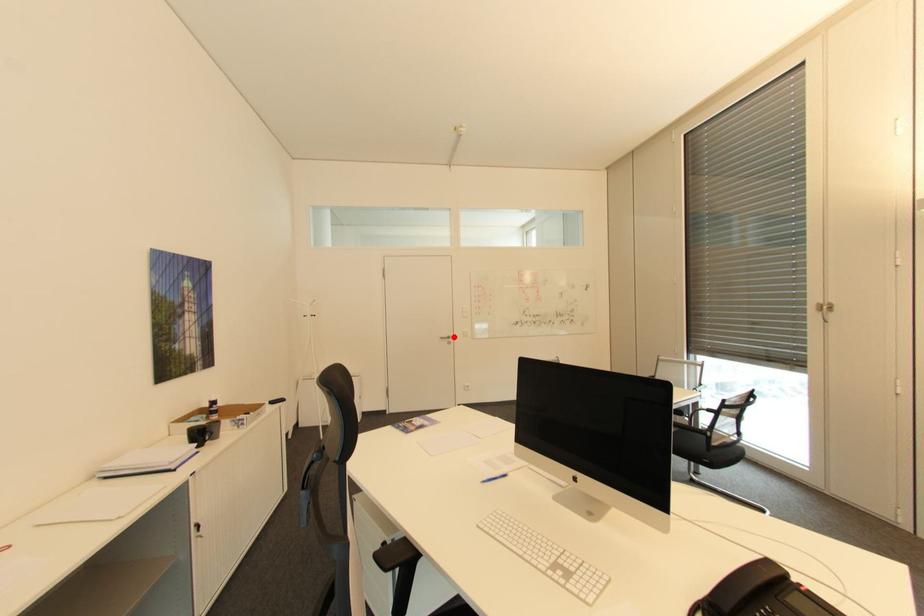
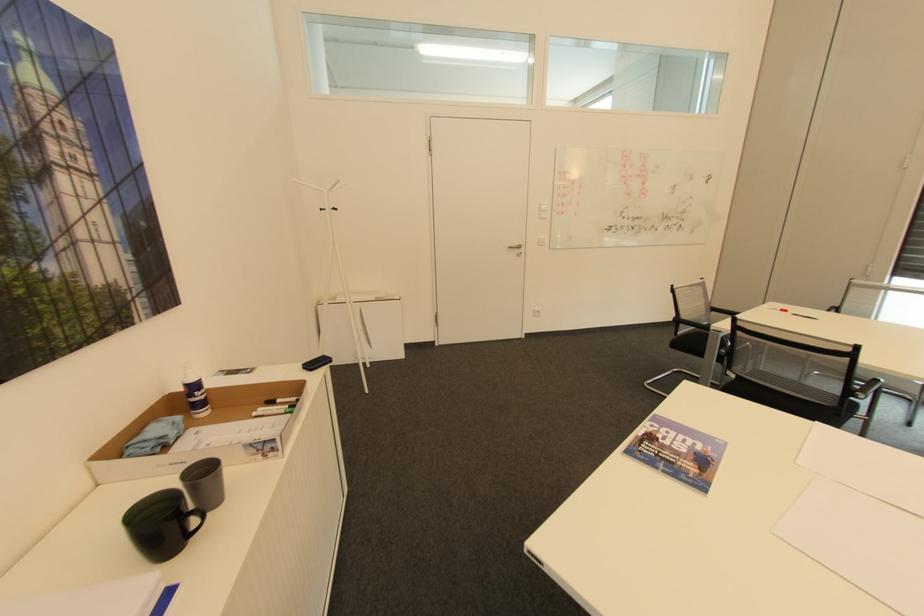
Where in the second image is the point corresponding to the highlighted location from the first image?

(524, 246)